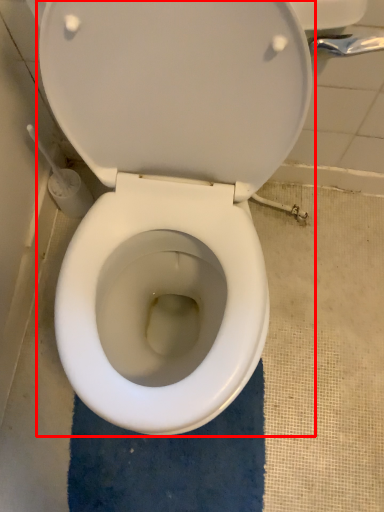
Question: Observing the image, what is the correct spatial positioning of toilet (annotated by the red box) in reference to bath mat?

Choices:
 (A) left
 (B) right

Answer: (B)